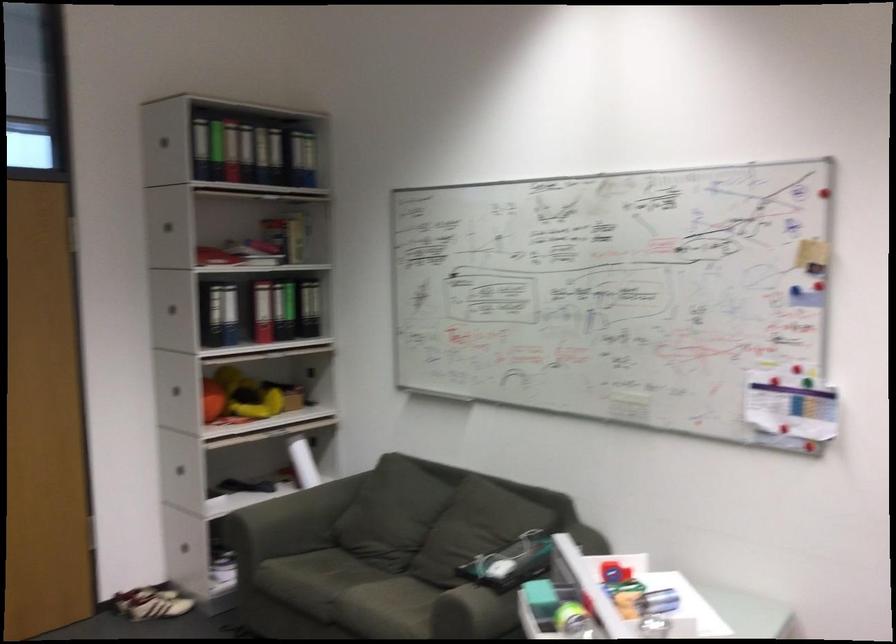
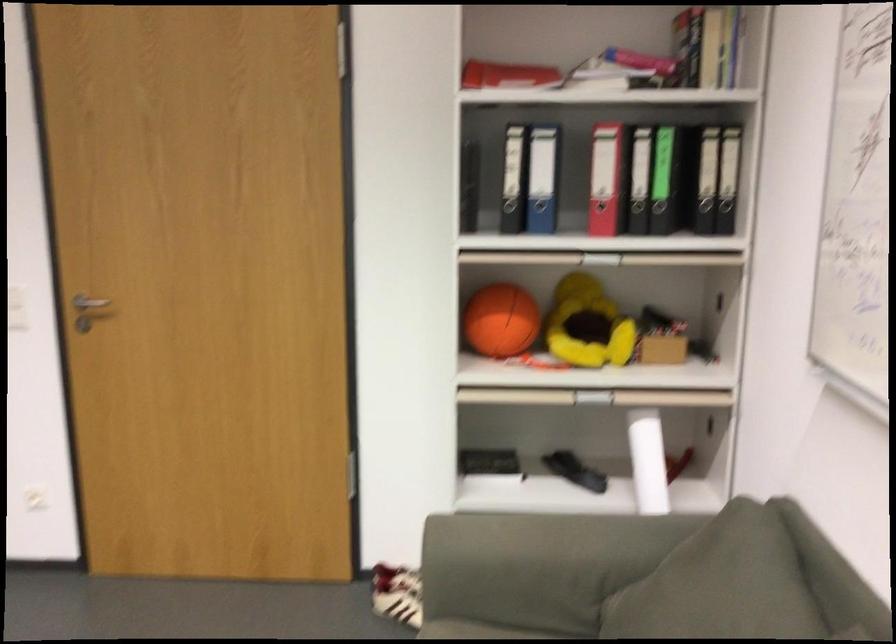
The point at (316, 371) is marked in the first image. Where is the corresponding point in the second image?

(725, 283)